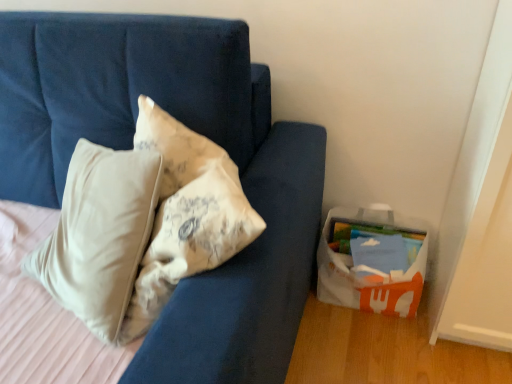
Where is `free space above white plastic basket at lower right (from a real-world perspective)`? The height and width of the screenshot is (384, 512). free space above white plastic basket at lower right (from a real-world perspective) is located at coordinates (382, 240).